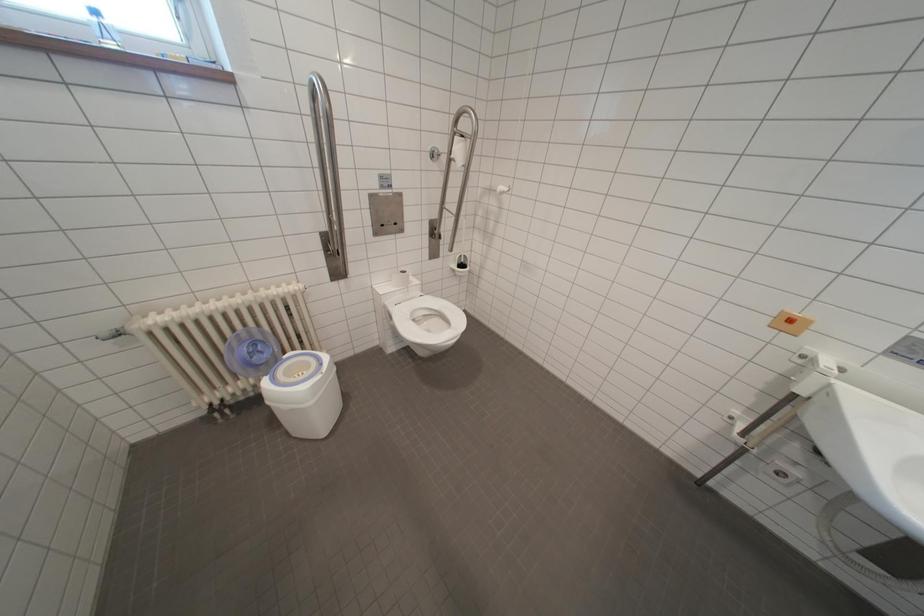
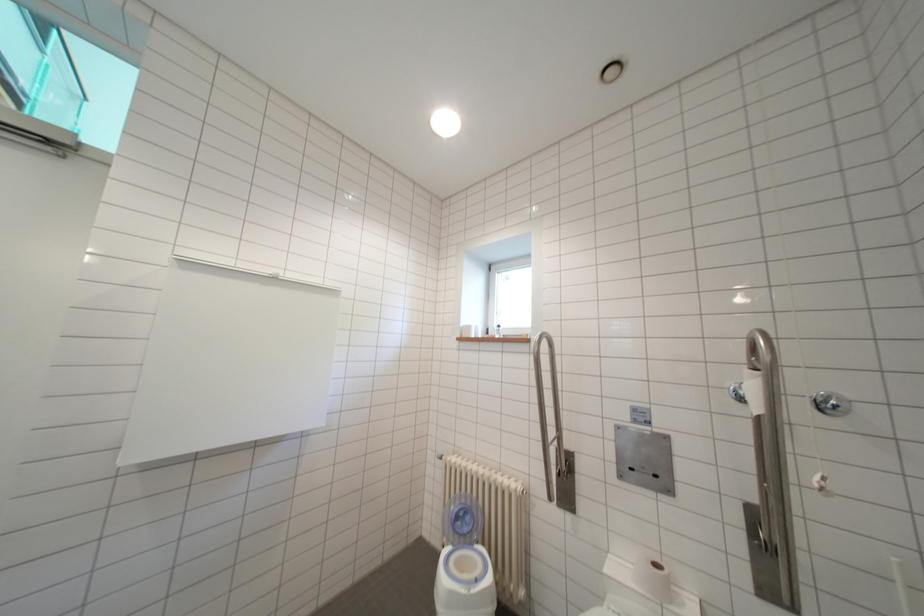
Based on the photo, how did the camera likely rotate?

The rotation direction of the camera is left-up.